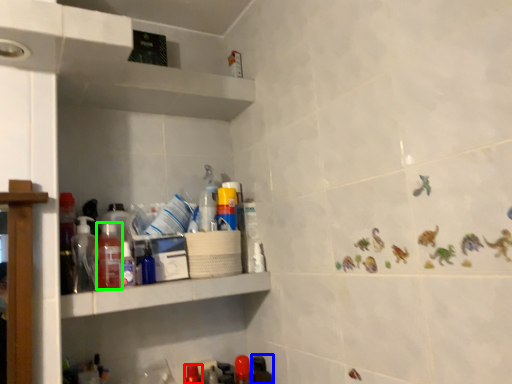
Question: Which object is positioned closest to bottle (highlighted by a red box)? Select from bottle (highlighted by a blue box) and bottle (highlighted by a green box).

Choices:
 (A) bottle
 (B) bottle

Answer: (A)